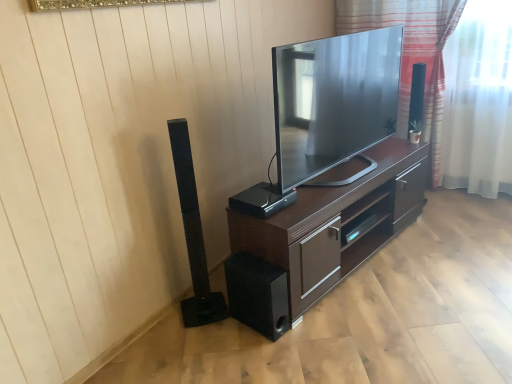
Question: Is matte black tv at center bigger or smaller than dark wood cabinet at center?

Choices:
 (A) small
 (B) big

Answer: (A)

Question: From their relative heights in the image, would you say matte black tv at center is taller or shorter than dark wood cabinet at center?

Choices:
 (A) short
 (B) tall

Answer: (B)

Question: Based on their relative distances, which object is nearer to the black plastic speaker at center, the 1th speaker in the right-to-left sequence?

Choices:
 (A) black matte speaker at lower center, the 2th speaker positioned from the right
 (B) matte black tv at center
 (C) dark wood cabinet at center
 (D) black matte speaker at left, the first speaker viewed from the left
 (E) striped fabric at upper right

Answer: (A)

Question: Which object is the farthest from the matte black tv at center?

Choices:
 (A) striped fabric at upper right
 (B) black matte speaker at left, the first speaker viewed from the left
 (C) dark wood cabinet at center
 (D) black plastic speaker at center, the 1th speaker in the right-to-left sequence
 (E) black matte speaker at lower center, the second speaker when ordered from left to right

Answer: (A)